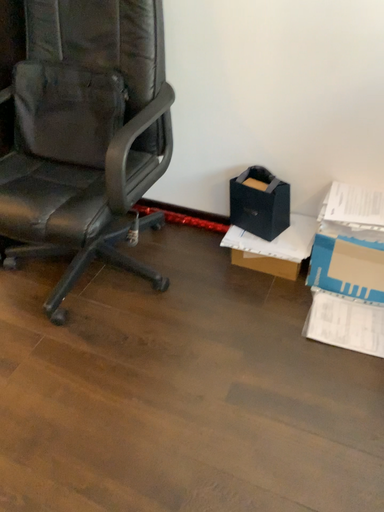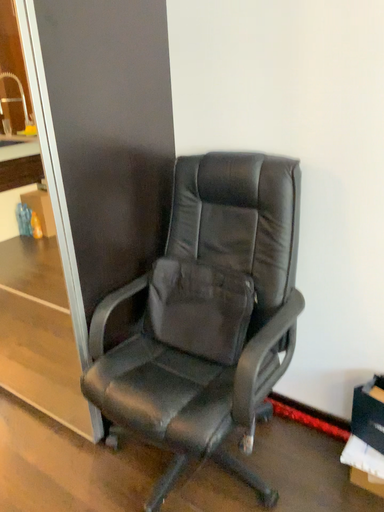
Question: How did the camera likely rotate when shooting the video?

Choices:
 (A) rotated downward
 (B) rotated upward

Answer: (B)